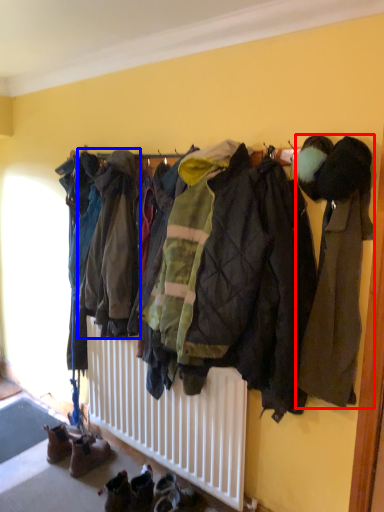
Question: Which object is further to the camera taking this photo, jacket (highlighted by a red box) or jacket (highlighted by a blue box)?

Choices:
 (A) jacket
 (B) jacket

Answer: (B)